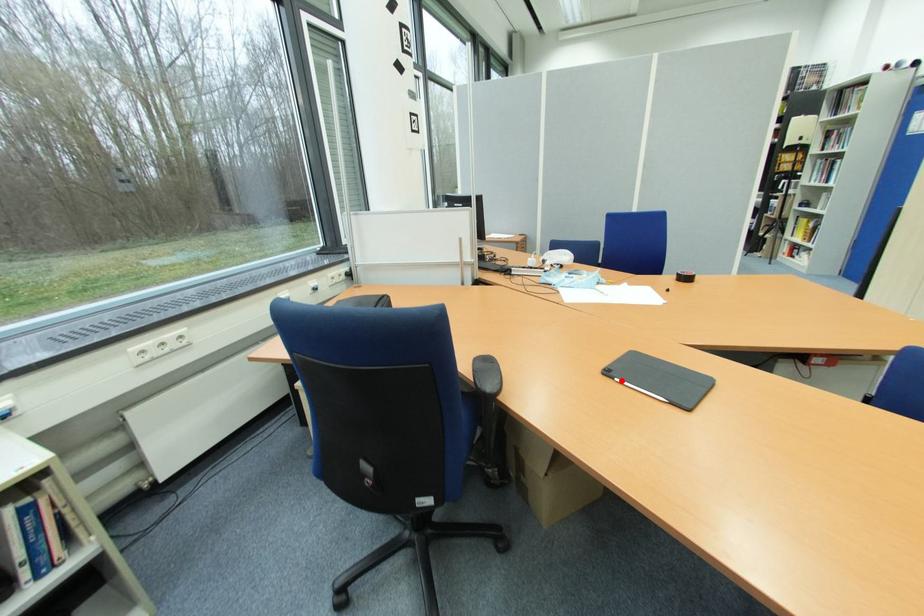
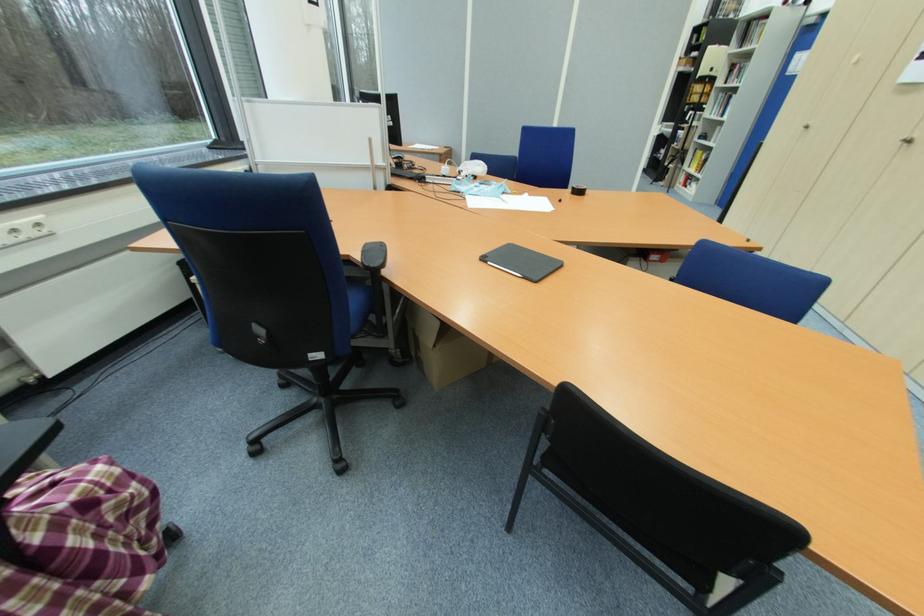
The point at the highlighted location is marked in the first image. Where is the corresponding point in the second image?

(492, 264)